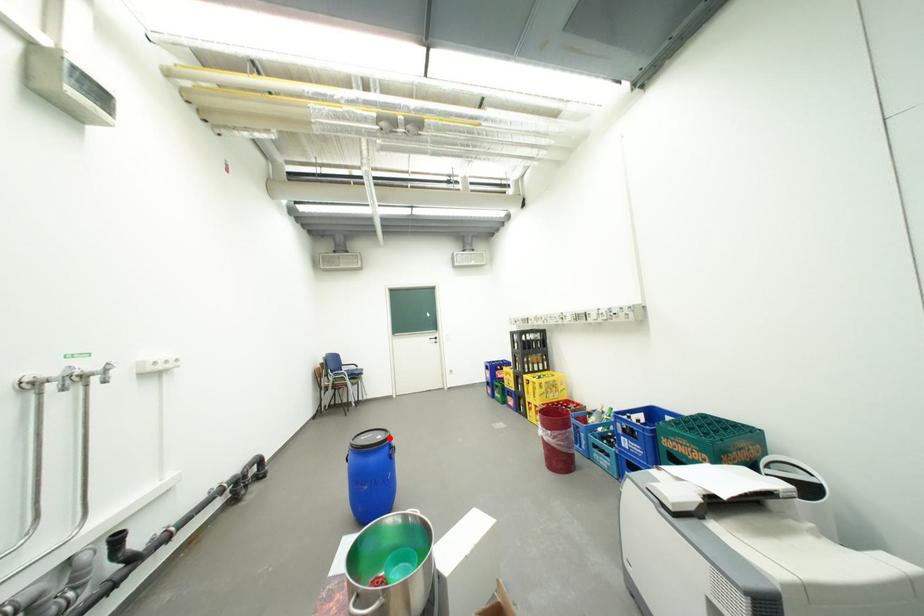
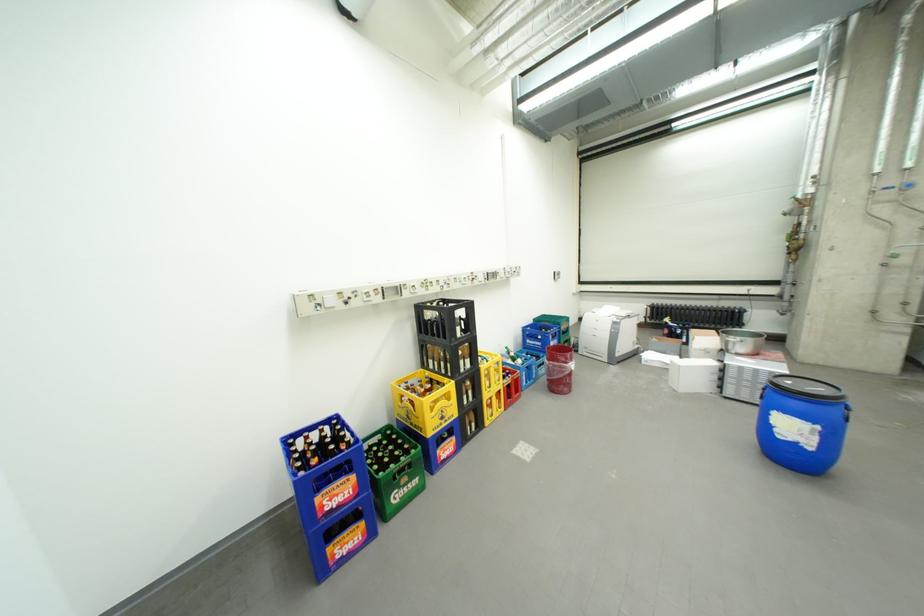
Locate, in the second image, the point that corresponds to the highlighted location in the first image.

(799, 383)